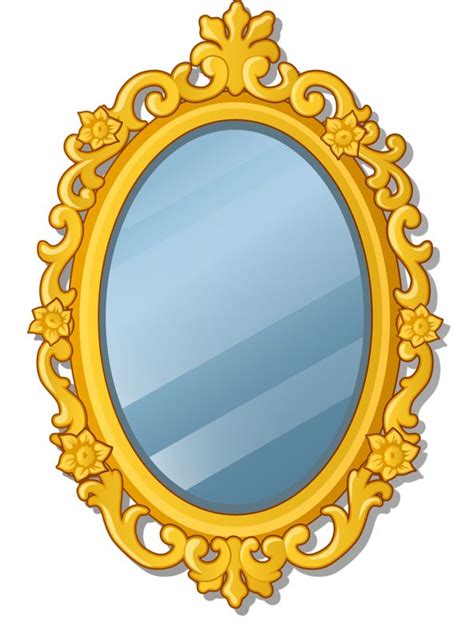
The height and width of the screenshot is (639, 474). I want to click on left bottom flower, so click(88, 450).